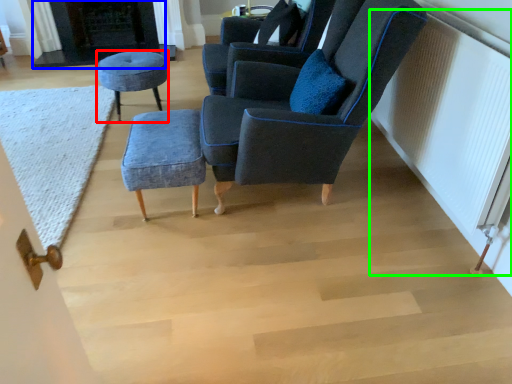
Question: Estimate the real-world distances between objects in this image. Which object is farther from stool (highlighted by a red box), fireplace (highlighted by a blue box) or radiator (highlighted by a green box)?

Choices:
 (A) fireplace
 (B) radiator

Answer: (B)